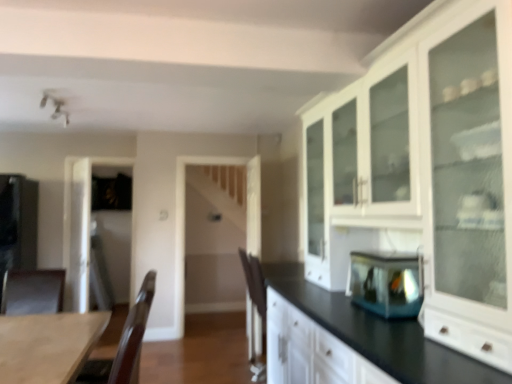
Question: Based on their positions, is matte black refrigerator at left, the second appliance viewed from the front, located to the left or right of wooden table at lower left?

Choices:
 (A) right
 (B) left

Answer: (B)

Question: Considering the positions of matte black refrigerator at left, marked as the 1th appliance in a back-to-front arrangement, and wooden table at lower left in the image, is matte black refrigerator at left, marked as the 1th appliance in a back-to-front arrangement, bigger or smaller than wooden table at lower left?

Choices:
 (A) small
 (B) big

Answer: (B)

Question: Estimate the real-world distances between objects in this image. Which object is farther from the brown leather armchair at lower left, the 1th armchair in the left-to-right sequence?

Choices:
 (A) brown wood armchair at left, the first armchair positioned from the right
 (B) white glossy cabinet at upper right
 (C) matte black refrigerator at left, the second appliance viewed from the front
 (D) wooden table at lower left
 (E) transparent glass fish tank at center, arranged as the 1th appliance when viewed from the right

Answer: (B)

Question: Which object is positioned closest to the transparent glass door at left?

Choices:
 (A) brown leather armchair at lower left, marked as the second armchair in a right-to-left arrangement
 (B) transparent glass fish tank at center, arranged as the 1th appliance when viewed from the right
 (C) wooden table at lower left
 (D) white glossy cabinet at upper right
 (E) matte black refrigerator at left, arranged as the 2th appliance when viewed from the right

Answer: (E)